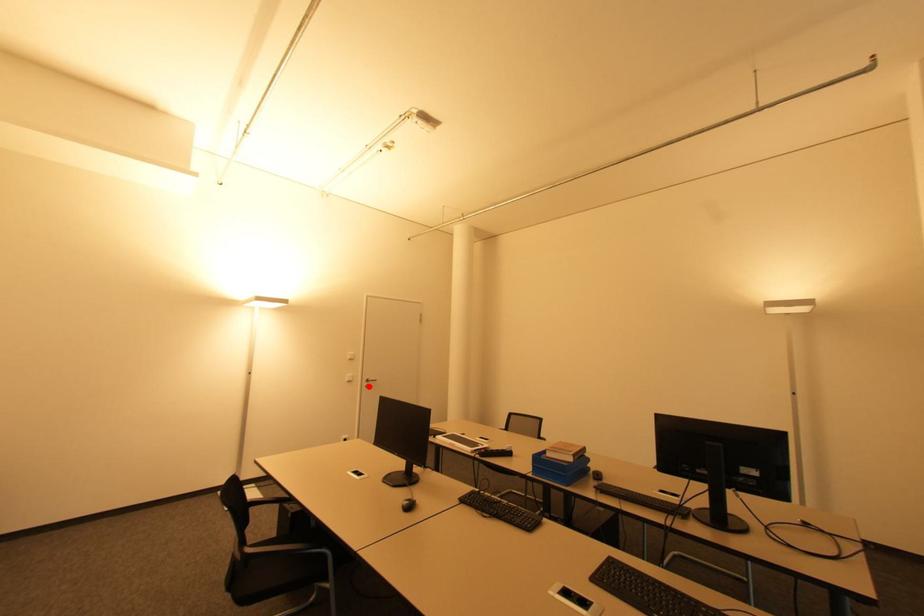
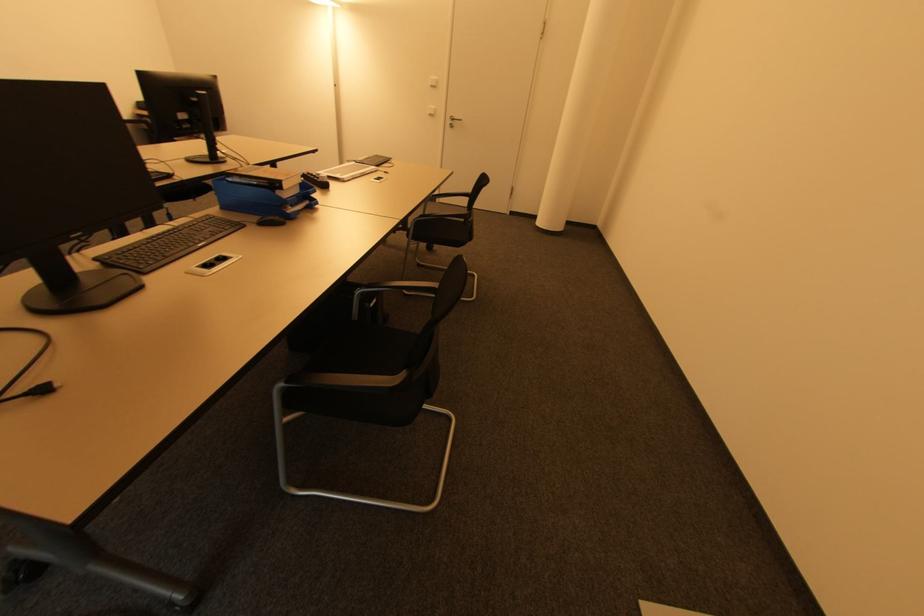
Locate, in the second image, the point that corresponds to the highlighted location in the first image.

(454, 127)